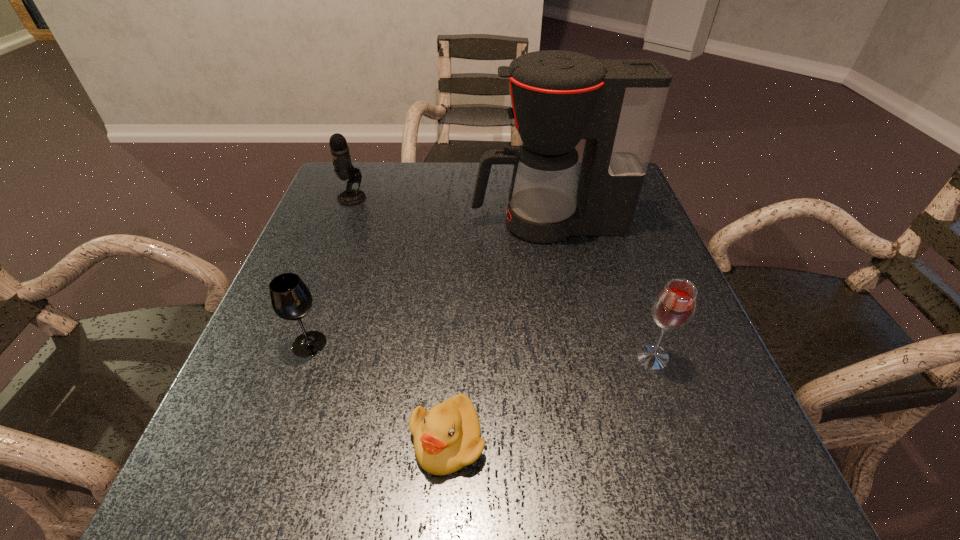
Identify the location of object located at the far left corner. The height and width of the screenshot is (540, 960). (344, 169).

What are the coordinates of `object situated at the far right corner` in the screenshot? It's located at (558, 97).

Where is `vacant space at the far edge of the desktop`? The height and width of the screenshot is (540, 960). vacant space at the far edge of the desktop is located at coordinates (489, 195).

In the image, there is a desktop. In order to click on vacant space at the near edge in this screenshot , I will do `click(395, 497)`.

The height and width of the screenshot is (540, 960). What are the coordinates of `vacant space at the left edge` in the screenshot? It's located at (331, 283).

You are a GUI agent. You are given a task and a screenshot of the screen. Output one action in this format:
    pyautogui.click(x=<x>, y=<y>)
    Task: Click on the vacant point at the right edge
    
    Given the screenshot: What is the action you would take?
    pyautogui.click(x=609, y=310)

At what (x,y) coordinates should I click in order to perform the action: click on free space at the near right corner. Please return your answer as a coordinate pair (x, y). Image resolution: width=960 pixels, height=540 pixels. Looking at the image, I should click on (760, 485).

Locate an element on the screen. This screenshot has width=960, height=540. empty space that is in between the left wineglass and the duckling is located at coordinates (378, 392).

Image resolution: width=960 pixels, height=540 pixels. What are the coordinates of `vacant space in between the shortest object and the tallest object` in the screenshot? It's located at [x=498, y=332].

Locate an element on the screen. The width and height of the screenshot is (960, 540). free space between the left wineglass and the duckling is located at coordinates (378, 392).